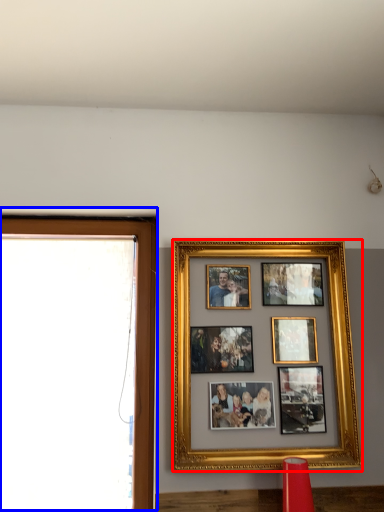
Question: Which object appears farthest to the camera in this image, picture frame (highlighted by a red box) or window frame (highlighted by a blue box)?

Choices:
 (A) picture frame
 (B) window frame

Answer: (B)